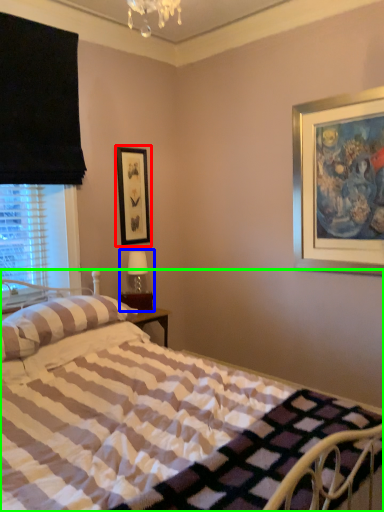
Question: Based on their relative distances, which object is farther from picture frame (highlighted by a red box)? Choose from table lamp (highlighted by a blue box) and bed (highlighted by a green box).

Choices:
 (A) table lamp
 (B) bed

Answer: (B)